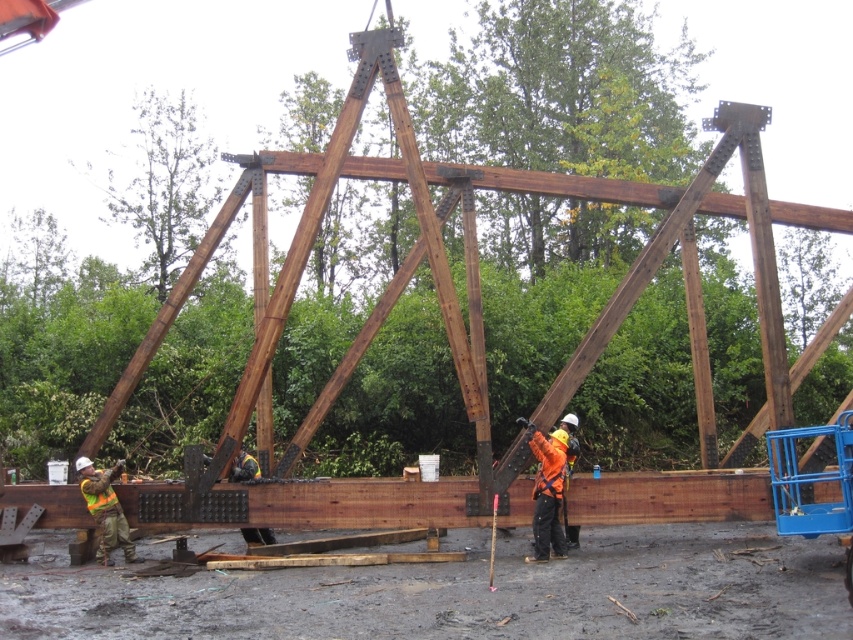
You are a safety inspector at the construction site shown in the image. You need to determine if the orange reflective vest at center and the reflective orange safety vest at lower left are positioned correctly based on their visibility. Which vest is more visible from the top of the structure?

→ The orange reflective vest at center is much taller than the reflective orange safety vest at lower left, so it is more visible from the top of the structure.

You are standing at the construction site and want to reach a specific point marked at coordinates point (550, 484). If you move forward 30 feet, will you reach that point?

The distance of point (550, 484) from viewer is 40.61 feet. Moving forward 30 feet would leave you 10.61 feet away from the point, so you will not reach it.

You are a safety inspector standing at the camera position observing the construction site. You need to check if the orange reflective vest at center is within the 10 meter safety zone. Is it within the required distance?

The orange reflective vest at center is 12.17 meters away from the camera, which exceeds the 10 meter safety zone. Therefore, it is outside the required distance.